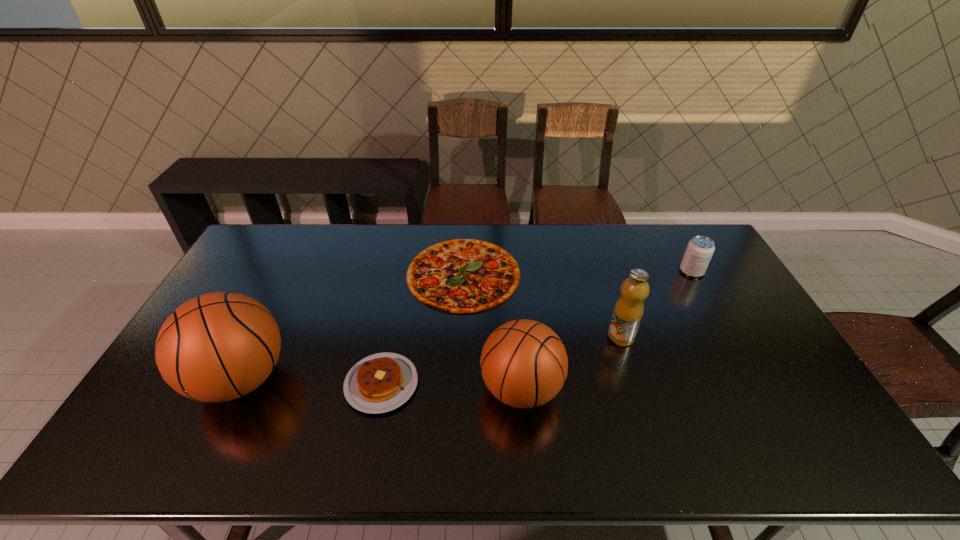
In the image, there is a desktop. At what (x,y) coordinates should I click in order to perform the action: click on vacant space at the near edge. Please return your answer as a coordinate pair (x, y). Image resolution: width=960 pixels, height=540 pixels. Looking at the image, I should click on (598, 416).

This screenshot has height=540, width=960. What are the coordinates of `free space at the right edge of the desktop` in the screenshot? It's located at (724, 343).

In the image, there is a desktop. Identify the location of free space at the far left corner. (270, 248).

The width and height of the screenshot is (960, 540). In order to click on vacant space at the far right corner in this screenshot , I will do `click(692, 230)`.

Locate an element on the screen. empty location between the fifth object from left to right and the rightmost object is located at coordinates (656, 304).

Identify the location of empty space that is in between the soda can and the shortest object. The height and width of the screenshot is (540, 960). (578, 272).

What are the coordinates of `unoccupied area between the shortest object and the taller basketball` in the screenshot? It's located at (352, 327).

The height and width of the screenshot is (540, 960). I want to click on vacant area that lies between the fourth tallest object and the fruit juice, so click(656, 304).

The height and width of the screenshot is (540, 960). I want to click on vacant area between the third shortest object and the leftmost object, so click(466, 325).

What are the coordinates of `empty space that is in between the pizza and the taller basketball` in the screenshot? It's located at (352, 327).